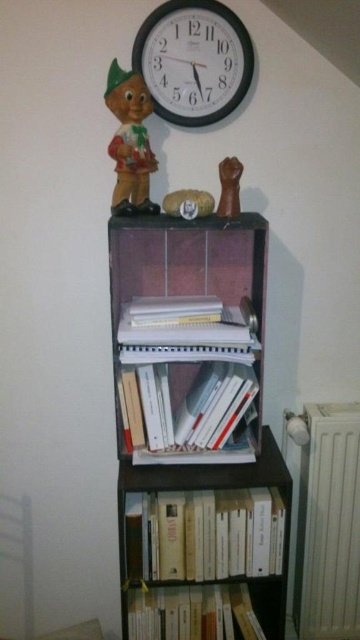
Who is positioned more to the left, white paper book at lower center or brown matte fist at upper center?

From the viewer's perspective, white paper book at lower center appears more on the left side.

Between point (271, 564) and point (237, 208), which one is positioned behind?

Point (271, 564)

This screenshot has width=360, height=640. What do you see at coordinates (205, 532) in the screenshot? I see `white paper book at lower center` at bounding box center [205, 532].

At what (x,y) coordinates should I click in order to perform the action: click on white paper book at lower center. Please return your answer as a coordinate pair (x, y). Looking at the image, I should click on (205, 532).

Based on the photo, is black wood bookshelf at center closer to camera compared to hardcover book at lower center?

Yes, black wood bookshelf at center is closer to the viewer.

Can you confirm if black wood bookshelf at center is positioned above hardcover book at lower center?

Correct, black wood bookshelf at center is located above hardcover book at lower center.

The height and width of the screenshot is (640, 360). What do you see at coordinates (216, 488) in the screenshot?
I see `black wood bookshelf at center` at bounding box center [216, 488].

You are a GUI agent. You are given a task and a screenshot of the screen. Output one action in this format:
    pyautogui.click(x=<x>, y=<y>)
    Task: Click on the black wood bookshelf at center
    The image size is (360, 640).
    Given the screenshot: What is the action you would take?
    pyautogui.click(x=216, y=488)

Does wooden bookshelf at center have a greater width compared to matte plastic figurine at upper left?

Yes.

Find the location of a particular element. wooden bookshelf at center is located at coordinates (255, 364).

You are a GUI agent. You are given a task and a screenshot of the screen. Output one action in this format:
    pyautogui.click(x=<x>, y=<y>)
    Task: Click on the wooden bookshelf at center
    
    Given the screenshot: What is the action you would take?
    pyautogui.click(x=255, y=364)